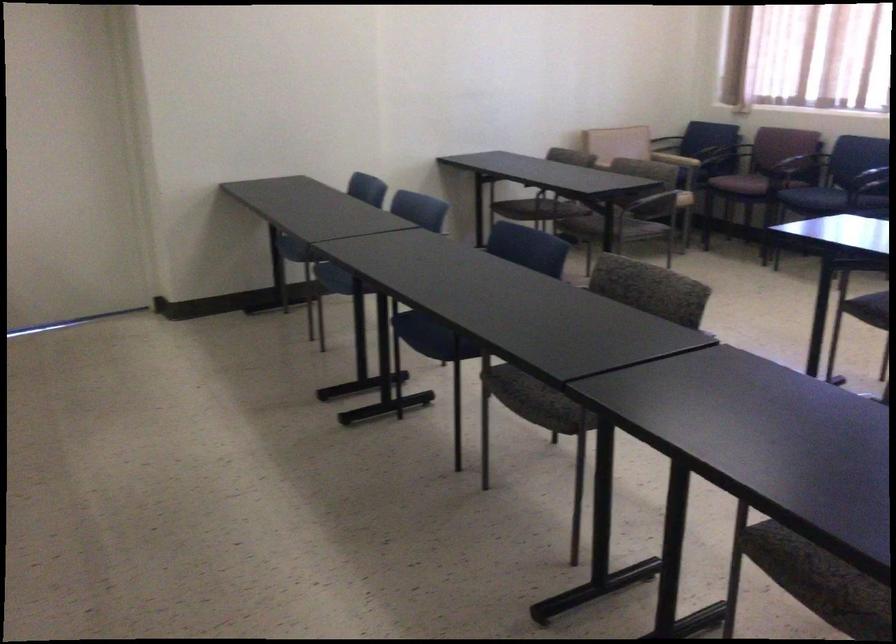
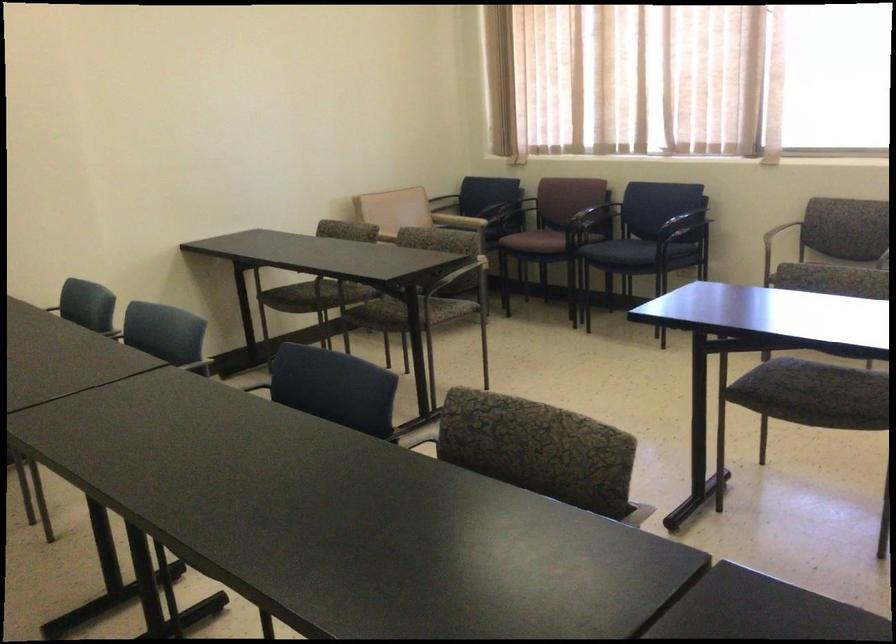
Locate, in the second image, the point that corresponds to (531,250) in the first image.

(332, 386)